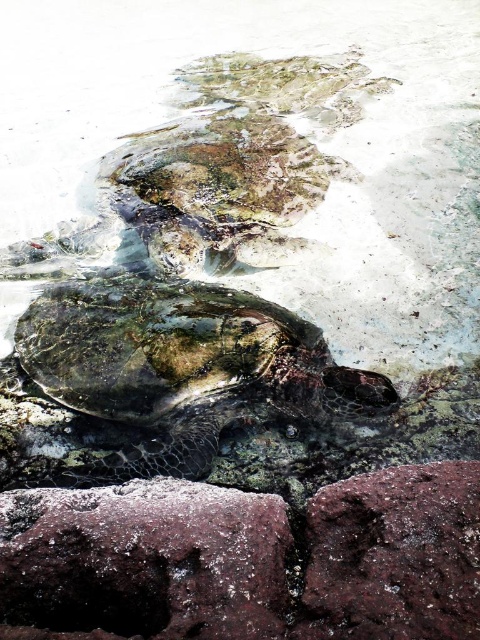
Does rusty metallic rock at lower left have a greater width compared to rusty metallic rock at lower right?

Yes, rusty metallic rock at lower left is wider than rusty metallic rock at lower right.

Identify the location of rusty metallic rock at lower left. (145, 561).

Can you confirm if shiny green turtle at center is shorter than textured brownish-green shell at upper center?

Indeed, shiny green turtle at center has a lesser height compared to textured brownish-green shell at upper center.

Is shiny green turtle at center to the left of textured brownish-green shell at upper center from the viewer's perspective?

Yes, shiny green turtle at center is to the left of textured brownish-green shell at upper center.

You are a GUI agent. You are given a task and a screenshot of the screen. Output one action in this format:
    pyautogui.click(x=<x>, y=<y>)
    Task: Click on the shiny green turtle at center
    The width and height of the screenshot is (480, 640).
    Given the screenshot: What is the action you would take?
    pyautogui.click(x=176, y=371)

Is the position of shiny green turtle at center less distant than that of rusty metallic rock at lower right?

No, it is not.

Locate an element on the screen. Image resolution: width=480 pixels, height=640 pixels. shiny green turtle at center is located at coordinates (176, 371).

Which is in front, point (133, 384) or point (331, 616)?

Point (331, 616)

The height and width of the screenshot is (640, 480). I want to click on shiny green turtle at center, so click(x=176, y=371).